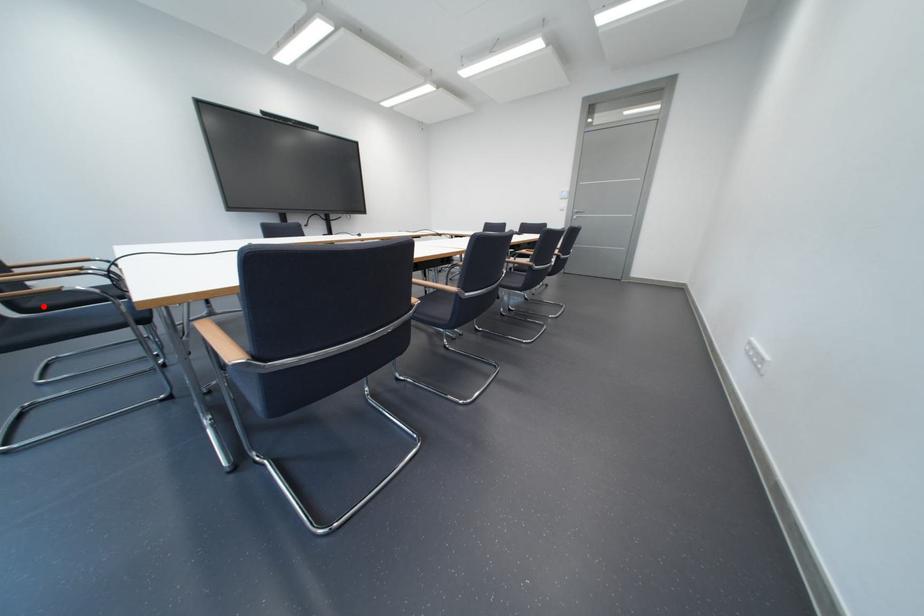
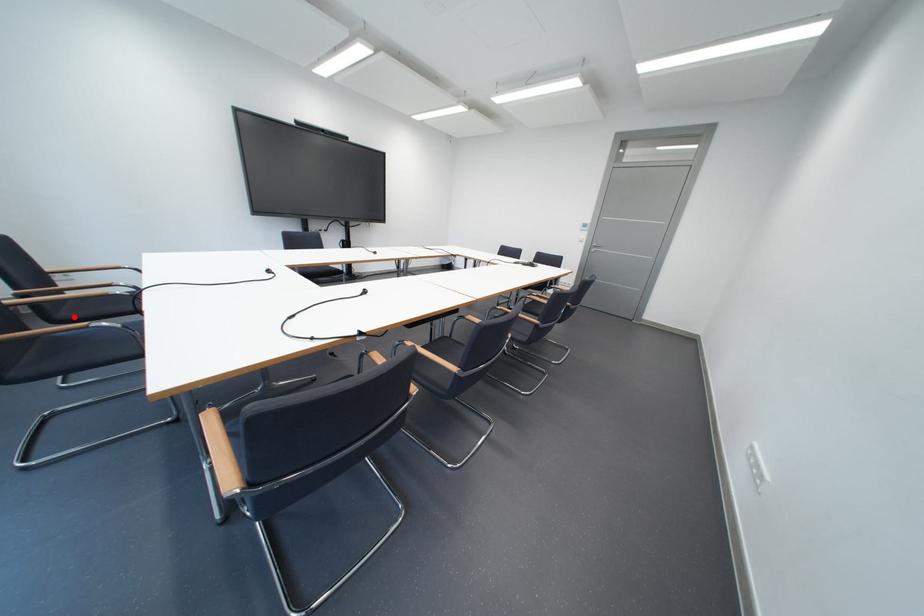
I am providing you with two images of the same scene from different viewpoints. A red point is marked on the first image and another point is marked on the second image. Do the highlighted points in image1 and image2 indicate the same real-world spot?

Yes